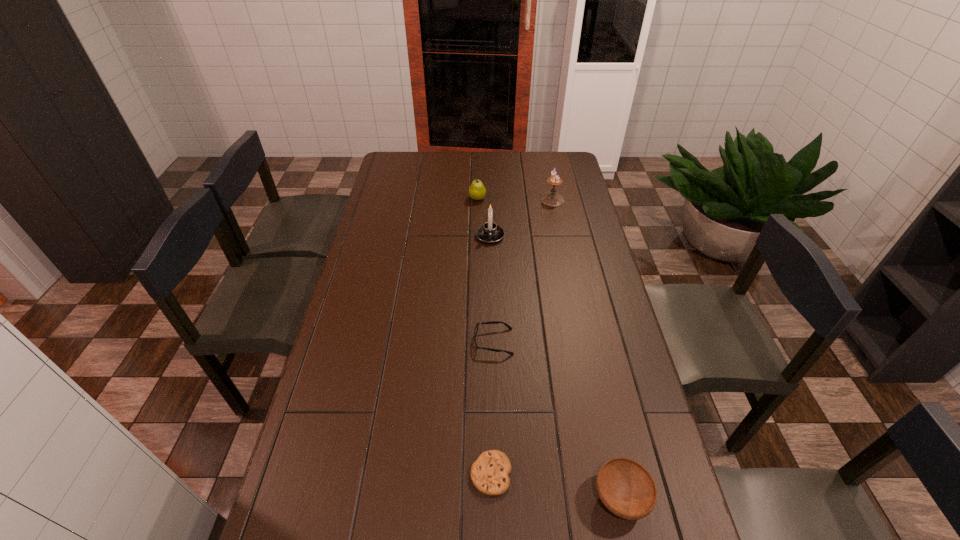
The image size is (960, 540). What are the coordinates of `vacant area at the right edge` in the screenshot? It's located at (642, 535).

I want to click on vacant area at the far left corner of the desktop, so tap(404, 168).

You are a GUI agent. You are given a task and a screenshot of the screen. Output one action in this format:
    pyautogui.click(x=<x>, y=<y>)
    Task: Click on the free space at the far right corner of the desktop
    
    Given the screenshot: What is the action you would take?
    pyautogui.click(x=549, y=174)

This screenshot has width=960, height=540. I want to click on free space between the farther candle holder and the bowl, so click(587, 349).

Identify the location of empty space between the shortest object and the right candle holder. The width and height of the screenshot is (960, 540). [521, 337].

Find the location of a particular element. empty space between the fifth tallest object and the nearer candle holder is located at coordinates (492, 289).

You are a GUI agent. You are given a task and a screenshot of the screen. Output one action in this format:
    pyautogui.click(x=<x>, y=<y>)
    Task: Click on the free point between the third shortest object and the farther candle holder
    This screenshot has height=540, width=960.
    Given the screenshot: What is the action you would take?
    pyautogui.click(x=587, y=349)

Image resolution: width=960 pixels, height=540 pixels. In order to click on unoccupied position between the shortest object and the pear in this screenshot , I will do `click(484, 336)`.

Identify the location of free space between the spectacles and the third shortest object. This screenshot has width=960, height=540. point(557,420).

Find the location of a particular element. This screenshot has width=960, height=540. vacant area between the fourth nearest object and the bowl is located at coordinates click(555, 367).